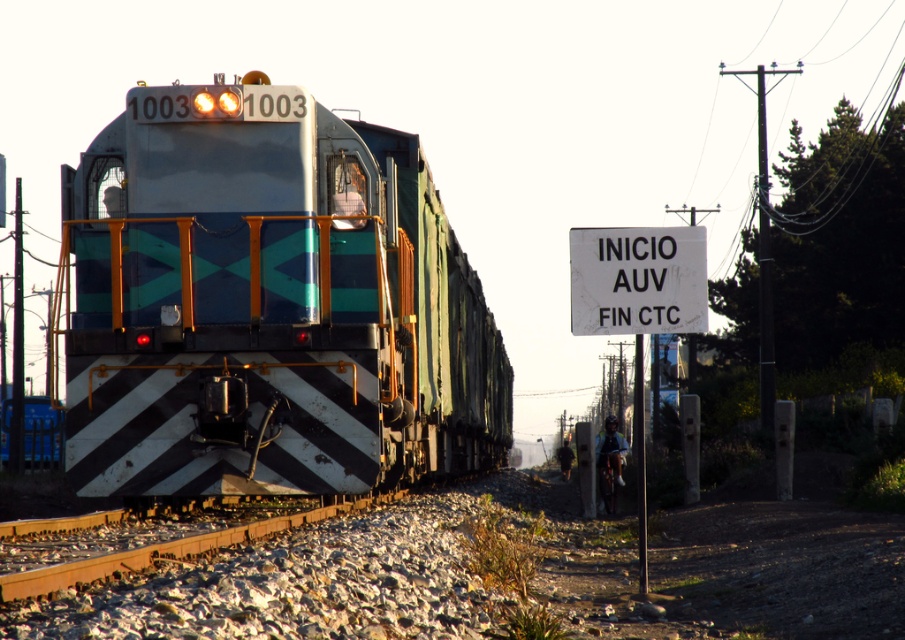
Which is below, metallic blue train at center or white plastic sign at upper right?

metallic blue train at center is lower down.

Is point (487, 339) behind point (611, 243)?

Yes, it is.

Find the location of a particular element. The width and height of the screenshot is (905, 640). metallic blue train at center is located at coordinates (268, 305).

Based on the photo, which is more to the left, white paper sign at center or white plastic sign at upper right?

white plastic sign at upper right is more to the left.

Based on the photo, who is lower down, white paper sign at center or white plastic sign at upper right?

white paper sign at center is lower down.

Identify the location of white paper sign at center. click(x=637, y=305).

Can you confirm if metallic blue train at center is positioned to the left of white paper sign at center?

Correct, you'll find metallic blue train at center to the left of white paper sign at center.

Does point (103, 484) lie behind point (596, 280)?

That is False.

Image resolution: width=905 pixels, height=640 pixels. In order to click on metallic blue train at center in this screenshot , I will do `click(268, 305)`.